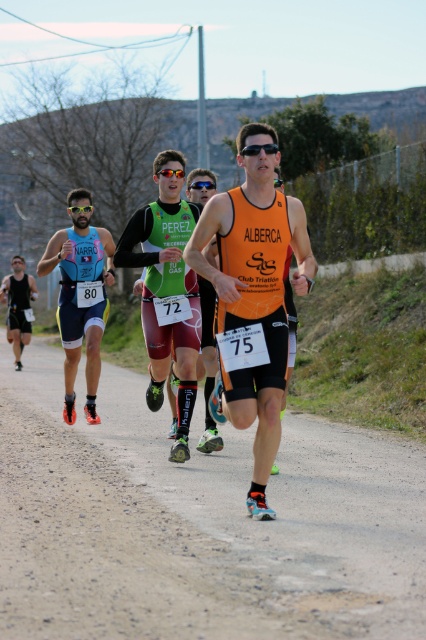
Between orange fabric singlet at center and matte blue triathlon suit at left, which one has more height?

With more height is orange fabric singlet at center.

Is point (215, 275) farther from viewer compared to point (77, 285)?

No, (215, 275) is in front of (77, 285).

Locate an element on the screen. The height and width of the screenshot is (640, 426). orange fabric singlet at center is located at coordinates (253, 298).

Can you confirm if matte blue triathlon suit at left is positioned to the left of blue reflective sunglasses at center?

Yes, matte blue triathlon suit at left is to the left of blue reflective sunglasses at center.

Can you confirm if matte blue triathlon suit at left is thinner than blue reflective sunglasses at center?

In fact, matte blue triathlon suit at left might be wider than blue reflective sunglasses at center.

Is point (92, 376) behind point (195, 184)?

Yes, point (92, 376) is behind point (195, 184).

Image resolution: width=426 pixels, height=640 pixels. I want to click on matte blue triathlon suit at left, so click(80, 301).

Does orange fabric singlet at center have a smaller size compared to green fabric jersey at center?

Indeed, orange fabric singlet at center has a smaller size compared to green fabric jersey at center.

Is the position of orange fabric singlet at center less distant than that of green fabric jersey at center?

Yes, it is in front of green fabric jersey at center.

What do you see at coordinates (253, 298) in the screenshot? The height and width of the screenshot is (640, 426). I see `orange fabric singlet at center` at bounding box center [253, 298].

Locate an element on the screen. orange fabric singlet at center is located at coordinates (253, 298).